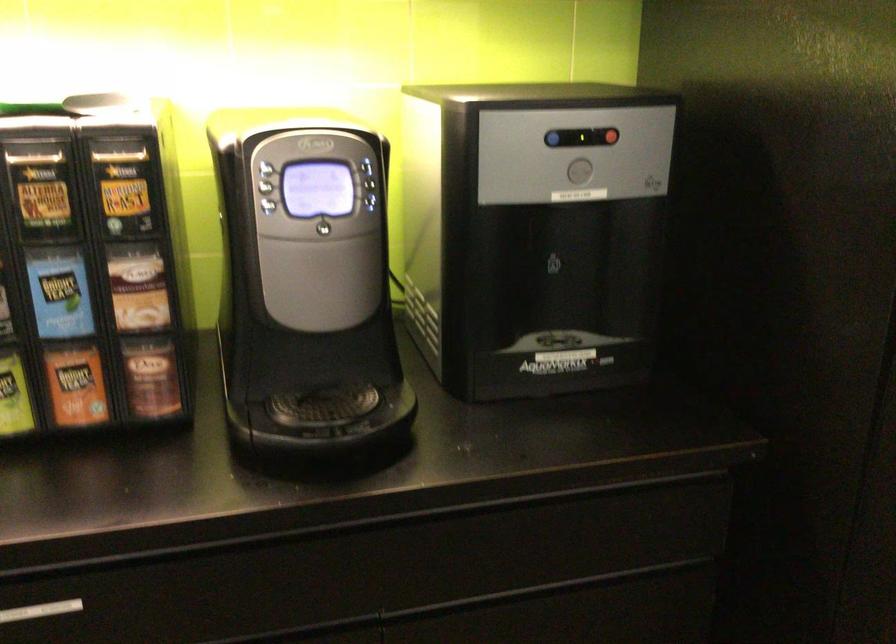
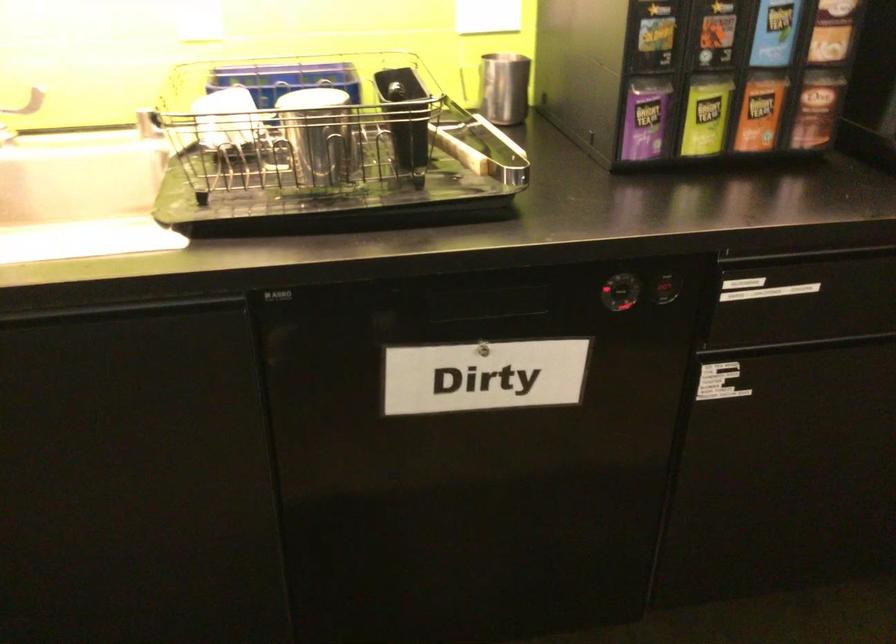
The point at (152, 375) is marked in the first image. Where is the corresponding point in the second image?

(816, 109)